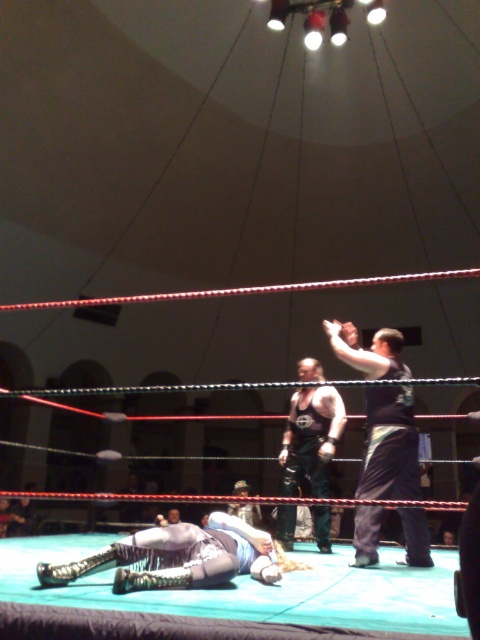
Is the position of dark blue fabric shirt at upper right less distant than that of black leather boots at center?

Yes, it is in front of black leather boots at center.

Which is above, dark blue fabric shirt at upper right or black leather boots at center?

dark blue fabric shirt at upper right is higher up.

This screenshot has width=480, height=640. Describe the element at coordinates (389, 445) in the screenshot. I see `dark blue fabric shirt at upper right` at that location.

Locate an element on the screen. The width and height of the screenshot is (480, 640). dark blue fabric shirt at upper right is located at coordinates (389, 445).